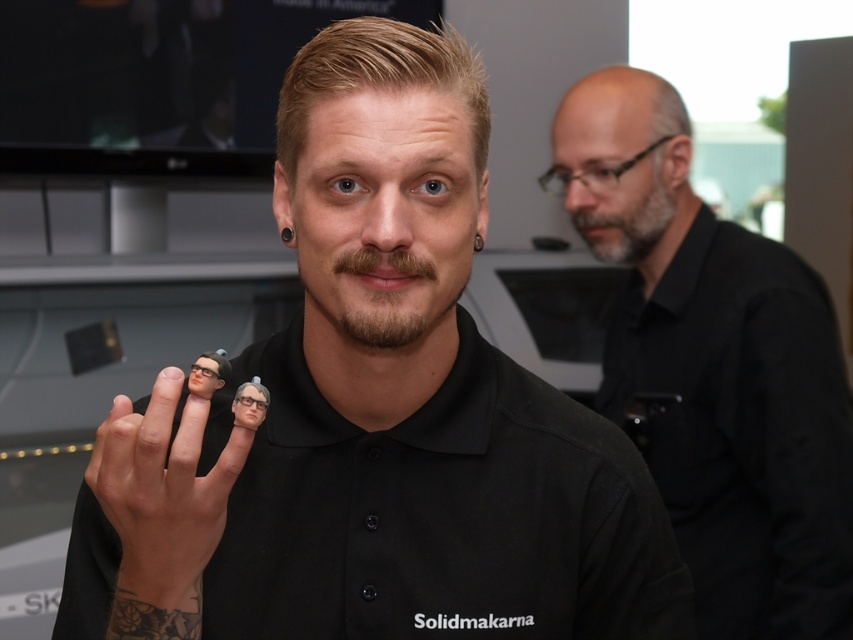
You are a photographer taking a closeup shot of the clear plastic miniature at center. The matte black finger at center is blocking your view. Can you move the finger to the side to get a clear shot of the miniature?

The matte black finger at center is in front of the clear plastic miniature at center, so moving the finger to the side would allow you to see the miniature clearly.

You are an event photographer trying to capture a clear photo of the black matte finger puppet at center and the black matte shirt at upper right. However, you notice that the finger puppet is partially blocking the view of the shirt. Based on their positions, can you adjust your camera angle to the left or right to ensure both objects are fully visible?

The black matte finger puppet at center is to the left of the black matte shirt at upper right. To ensure both are fully visible, you should adjust your camera angle to the right so that the finger puppet moves out of the way of the shirt.

Looking at this image, you are a photographer standing 24 inches away from the camera. You want to take a closeup shot of the black matte finger puppet at center. Can you get close enough to the puppet to take the photo?

The black matte finger puppet at center and camera are 21.06 inches apart from each other. Since you are standing 24 inches away from the camera, you are 24 inches away from the puppet, which is slightly further than the distance between the puppet and the camera. You might need to move closer to the puppet to ensure it fills the frame properly for a closeup.